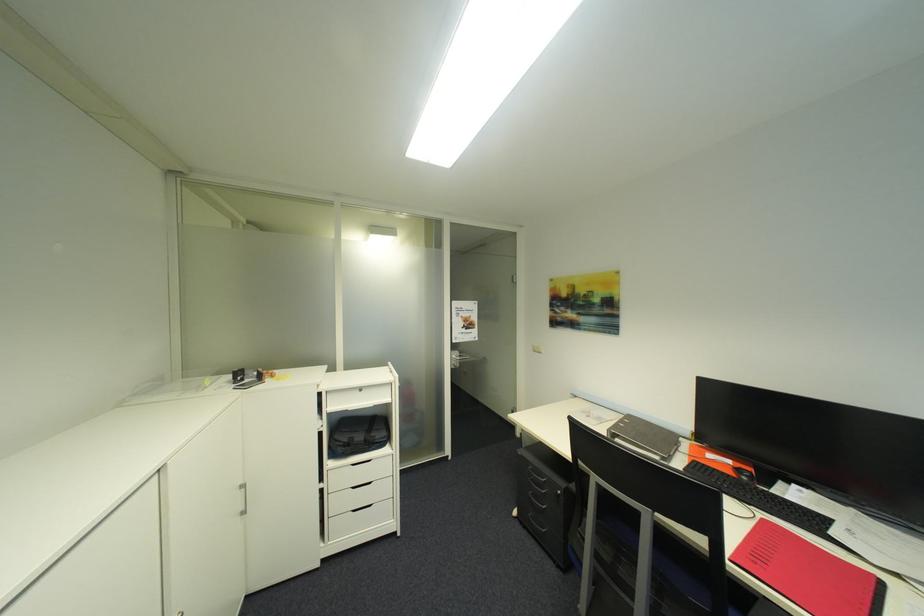
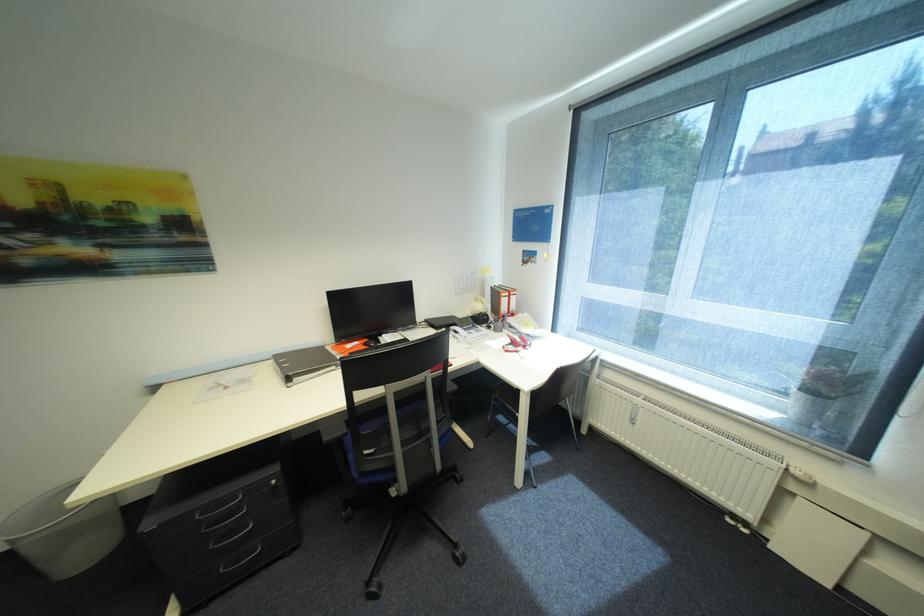
Question: I am providing you with two images of the same scene from different viewpoints. Which of the following objects are not visible in image2?

Choices:
 (A) utensil holder
 (B) red notebook
 (C) blue chair sitting surface
 (D) red ring binder

Answer: (B)